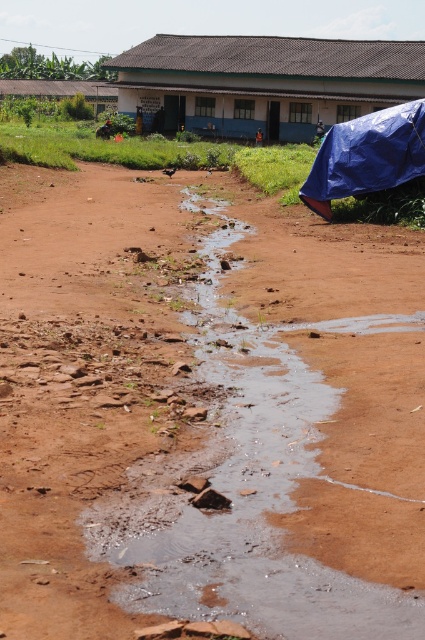
Question: Is blue corrugated metal hut at upper center positioned at the back of brown corrugated metal hut at upper center?

Choices:
 (A) no
 (B) yes

Answer: (A)

Question: Can you confirm if blue corrugated metal hut at upper center is positioned to the right of brown corrugated metal hut at upper center?

Choices:
 (A) no
 (B) yes

Answer: (B)

Question: Which object appears closest to the camera in this image?

Choices:
 (A) brown corrugated metal hut at upper center
 (B) blue corrugated metal hut at upper center

Answer: (B)

Question: In this image, where is blue corrugated metal hut at upper center located relative to brown corrugated metal hut at upper center?

Choices:
 (A) right
 (B) left

Answer: (A)